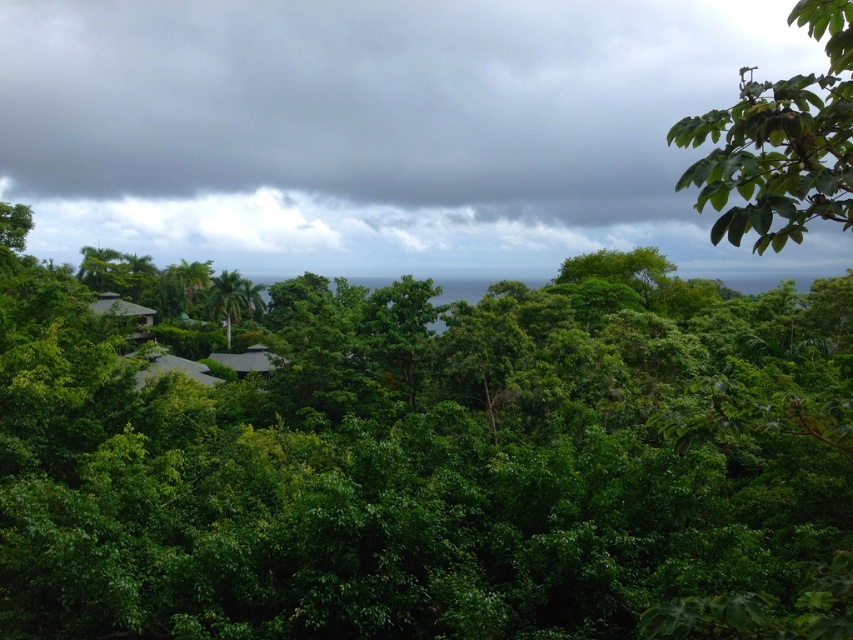
Which is in front, point (416, 28) or point (828, 90)?

Point (828, 90) is in front.

Looking at this image, does dark gray cloud at upper center have a lesser height compared to green leafy tree at upper right?

Correct, dark gray cloud at upper center is not as tall as green leafy tree at upper right.

This screenshot has width=853, height=640. Identify the location of dark gray cloud at upper center. (376, 128).